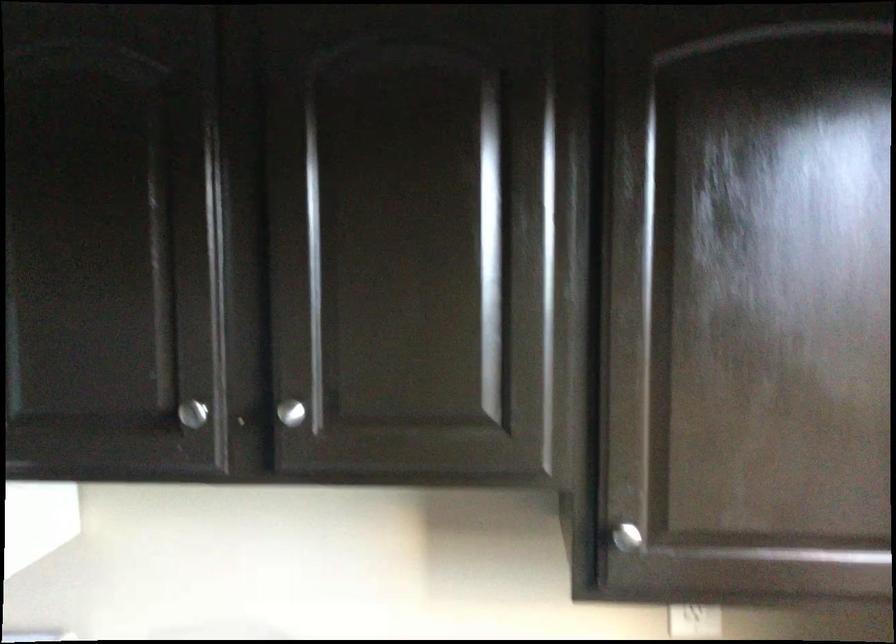
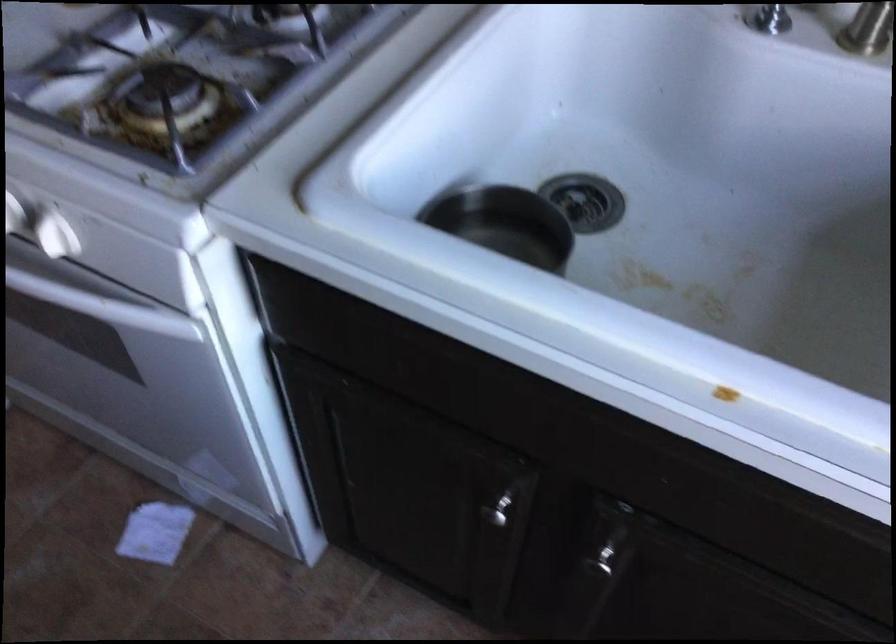
How did the camera likely rotate?

The camera rotated toward left-down.